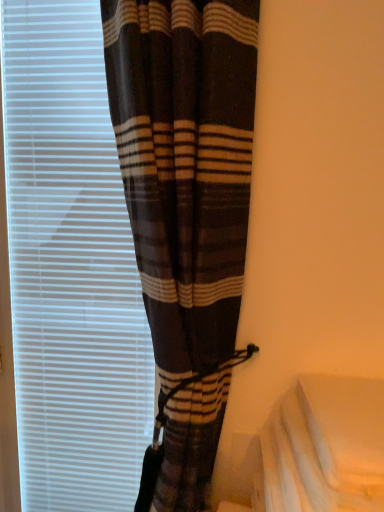
Question: Can you confirm if brown plaid curtain at left is smaller than white matte window blind at left?

Choices:
 (A) yes
 (B) no

Answer: (B)

Question: Is brown plaid curtain at left bigger than white matte window blind at left?

Choices:
 (A) no
 (B) yes

Answer: (B)

Question: Is brown plaid curtain at left located outside white matte window blind at left?

Choices:
 (A) no
 (B) yes

Answer: (B)

Question: From a real-world perspective, is brown plaid curtain at left on top of white matte window blind at left?

Choices:
 (A) yes
 (B) no

Answer: (A)

Question: Considering the relative sizes of brown plaid curtain at left and white matte window blind at left in the image provided, is brown plaid curtain at left taller than white matte window blind at left?

Choices:
 (A) yes
 (B) no

Answer: (B)

Question: Choose the correct answer: Is white matte window blind at left inside white fabric at lower right or outside it?

Choices:
 (A) outside
 (B) inside

Answer: (A)

Question: From the image's perspective, is white matte window blind at left above or below white fabric at lower right?

Choices:
 (A) below
 (B) above

Answer: (B)

Question: Is point (59, 12) positioned closer to the camera than point (382, 479)?

Choices:
 (A) farther
 (B) closer

Answer: (A)

Question: Considering the positions of white matte window blind at left and white fabric at lower right in the image, is white matte window blind at left taller or shorter than white fabric at lower right?

Choices:
 (A) short
 (B) tall

Answer: (B)

Question: Visually, is brown plaid curtain at left positioned to the left or to the right of white matte window blind at left?

Choices:
 (A) left
 (B) right

Answer: (B)

Question: Considering the positions of brown plaid curtain at left and white matte window blind at left in the image, is brown plaid curtain at left bigger or smaller than white matte window blind at left?

Choices:
 (A) small
 (B) big

Answer: (B)

Question: Is point (130, 39) closer or farther from the camera than point (56, 429)?

Choices:
 (A) farther
 (B) closer

Answer: (B)

Question: From a real-world perspective, is brown plaid curtain at left physically located above or below white matte window blind at left?

Choices:
 (A) above
 (B) below

Answer: (A)

Question: Is point (364, 482) closer or farther from the camera than point (226, 221)?

Choices:
 (A) closer
 (B) farther

Answer: (A)

Question: Relative to brown plaid curtain at left, is white fabric at lower right in front or behind?

Choices:
 (A) front
 (B) behind

Answer: (B)